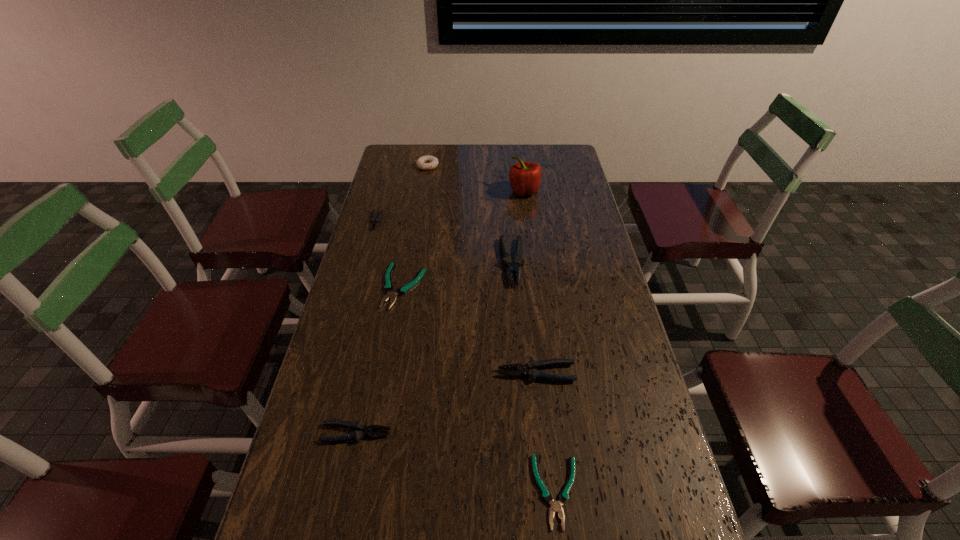
At what (x,y) coordinates should I click in order to perform the action: click on bell pepper. Please return your answer as a coordinate pair (x, y). Looking at the image, I should click on (525, 178).

Identify the location of pink bell pepper. The width and height of the screenshot is (960, 540). (525, 178).

The height and width of the screenshot is (540, 960). Find the location of `the farthest object`. the farthest object is located at coordinates [x=427, y=162].

This screenshot has width=960, height=540. What are the coordinates of `white doughnut` in the screenshot? It's located at (427, 162).

Find the location of a particular element. The height and width of the screenshot is (540, 960). the biggest gray pliers is located at coordinates (512, 268).

The width and height of the screenshot is (960, 540). Find the location of `the tallest pliers`. the tallest pliers is located at coordinates (512, 268).

Find the location of `the fifth shortest pliers`. the fifth shortest pliers is located at coordinates (529, 369).

Identify the location of the second biggest gray pliers. This screenshot has height=540, width=960. (529, 369).

This screenshot has height=540, width=960. In order to click on the fifth farthest pliers in this screenshot , I will do `click(357, 435)`.

I want to click on the nearest gray pliers, so click(x=357, y=435).